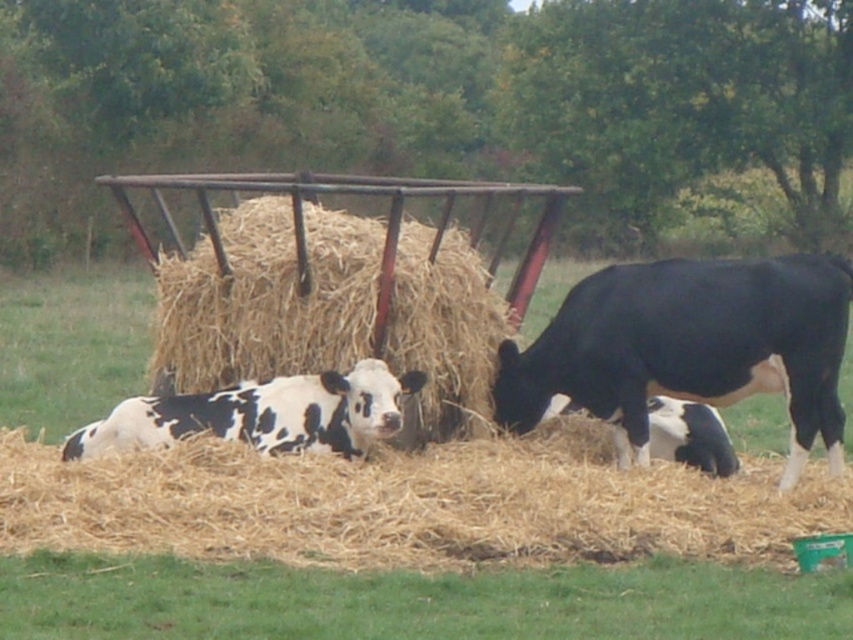
Can you confirm if light brown straw at center is wider than black and white spotted calf at center?

Correct, the width of light brown straw at center exceeds that of black and white spotted calf at center.

Does light brown straw at center have a larger size compared to black and white spotted calf at center?

Yes.

Between point (688, 509) and point (229, 404), which one is positioned behind?

The point (229, 404) is behind.

Where is `light brown straw at center`? light brown straw at center is located at coordinates (404, 506).

Is wooden hay feeder at center positioned before black and white spotted calf at center?

That is True.

Can you confirm if wooden hay feeder at center is wider than black and white spotted calf at center?

Yes, wooden hay feeder at center is wider than black and white spotted calf at center.

Does point (430, 180) come in front of point (312, 435)?

That is False.

At what (x,y) coordinates should I click in order to perform the action: click on wooden hay feeder at center. Please return your answer as a coordinate pair (x, y). The height and width of the screenshot is (640, 853). Looking at the image, I should click on (338, 282).

Between light brown straw at center and black glossy cow at right, which one is positioned higher?

Positioned higher is black glossy cow at right.

Consider the image. Measure the distance from light brown straw at center to black glossy cow at right.

light brown straw at center and black glossy cow at right are 4.03 feet apart.

Identify the location of light brown straw at center. This screenshot has height=640, width=853. (404, 506).

Where is `light brown straw at center`? light brown straw at center is located at coordinates (404, 506).